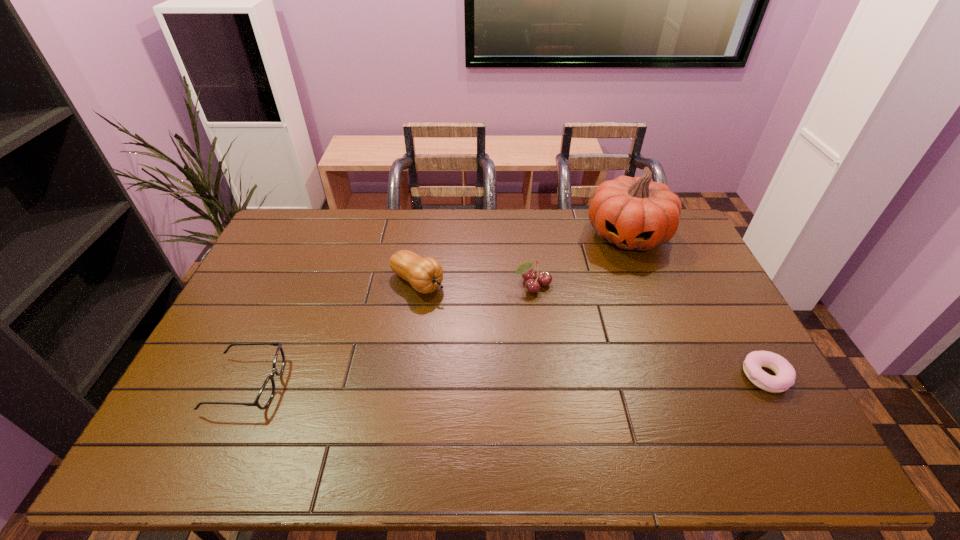
At what (x,y) coordinates should I click in order to perform the action: click on the fourth tallest object. Please return your answer as a coordinate pair (x, y). This screenshot has height=540, width=960. Looking at the image, I should click on (267, 391).

I want to click on the leftmost object, so click(x=267, y=391).

Identify the location of doughnut. (785, 377).

The height and width of the screenshot is (540, 960). Find the location of `the third object from left to right`. the third object from left to right is located at coordinates (544, 278).

This screenshot has width=960, height=540. In order to click on pumpkin in this screenshot , I will do `click(633, 213)`.

Where is `the tallest object`? the tallest object is located at coordinates (633, 213).

Locate an element on the screen. This screenshot has height=540, width=960. gourd is located at coordinates (425, 275).

What are the coordinates of `vacant area located 0.210m on the front-facing side of the second shortest object` in the screenshot? It's located at (360, 384).

At what (x,y) coordinates should I click in order to perform the action: click on free spot located on the left of the shortest object. Please return your answer as a coordinate pair (x, y). This screenshot has height=540, width=960. Looking at the image, I should click on (693, 376).

Where is `vacant space located 0.230m on the leaves of the cherry`? The height and width of the screenshot is (540, 960). vacant space located 0.230m on the leaves of the cherry is located at coordinates (560, 354).